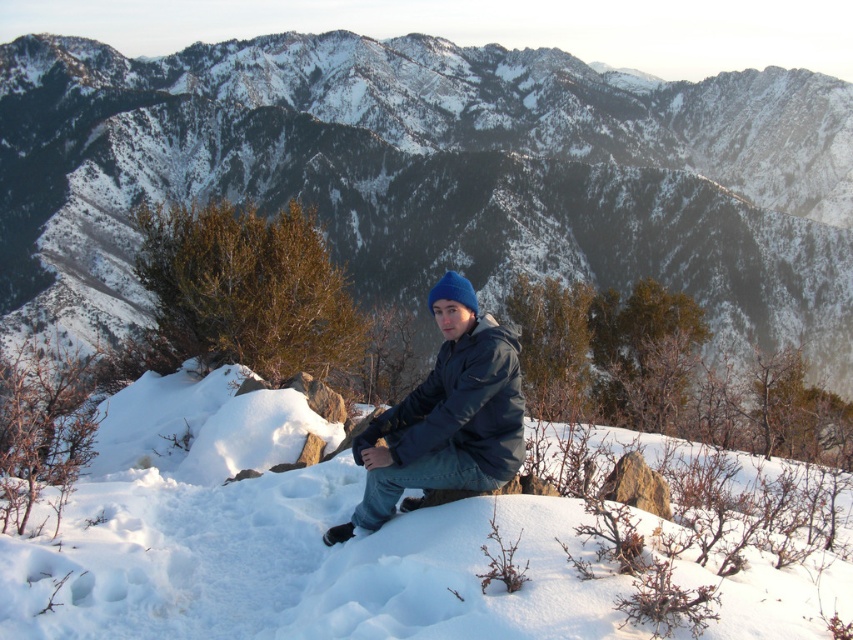
Can you confirm if snowy mountain at center is positioned to the left of blue matte jacket at center?

Incorrect, snowy mountain at center is not on the left side of blue matte jacket at center.

How distant is snowy mountain at center from blue matte jacket at center?

A distance of 192.56 meters exists between snowy mountain at center and blue matte jacket at center.

Which is in front, point (712, 108) or point (459, 332)?

Point (459, 332) is more forward.

The height and width of the screenshot is (640, 853). Find the location of `snowy mountain at center`. snowy mountain at center is located at coordinates (434, 176).

Does snowy mountain at center appear on the right side of white fluffy snow at center?

Correct, you'll find snowy mountain at center to the right of white fluffy snow at center.

Consider the image. Does snowy mountain at center have a lesser width compared to white fluffy snow at center?

No.

Image resolution: width=853 pixels, height=640 pixels. Find the location of `snowy mountain at center`. snowy mountain at center is located at coordinates (434, 176).

Between white fluffy snow at center and blue matte jacket at center, which one is positioned higher?

Positioned higher is blue matte jacket at center.

Is white fluffy snow at center wider than blue matte jacket at center?

Correct, the width of white fluffy snow at center exceeds that of blue matte jacket at center.

Does point (160, 417) come behind point (390, 513)?

Yes.

Where is `white fluffy snow at center`? The height and width of the screenshot is (640, 853). white fluffy snow at center is located at coordinates (274, 538).